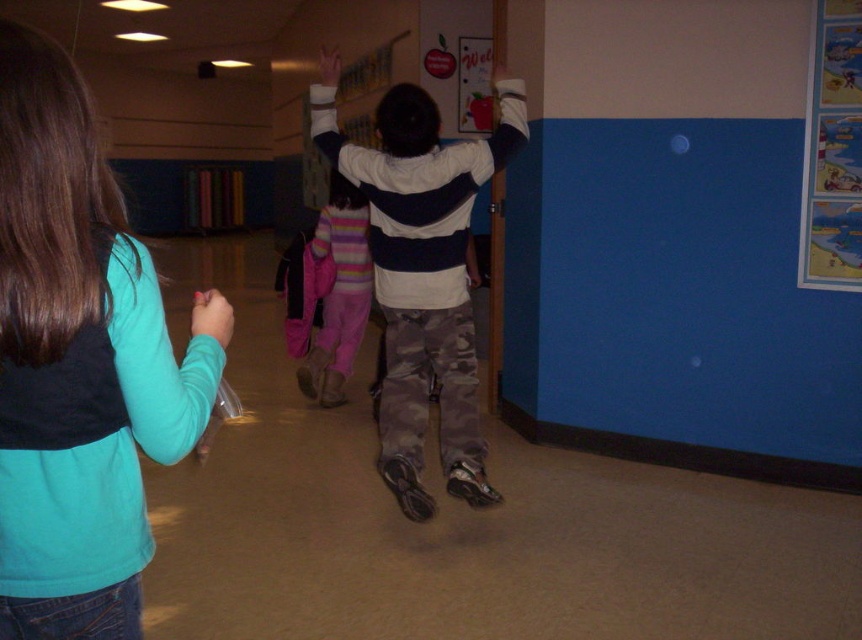
You are a student in the hallway and want to hand a note to the person wearing the camouflage pants at center. The person is facing away from you. Can you reach them without moving past the teal fabric shirt at left?

The teal fabric shirt at left is in front of camouflage pants at center, so you would need to move past the teal fabric shirt at left to reach the camouflage pants at center.